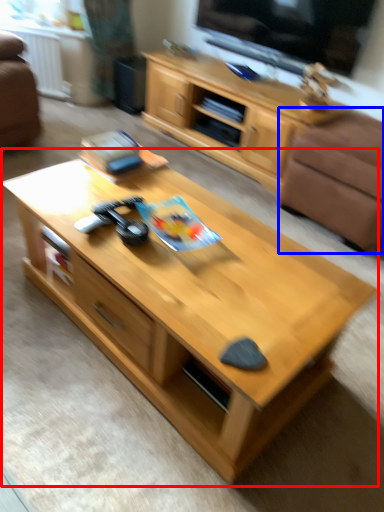
Question: Which point is closer to the camera, coffee table (highlighted by a red box) or armchair (highlighted by a blue box)?

Choices:
 (A) coffee table
 (B) armchair

Answer: (A)